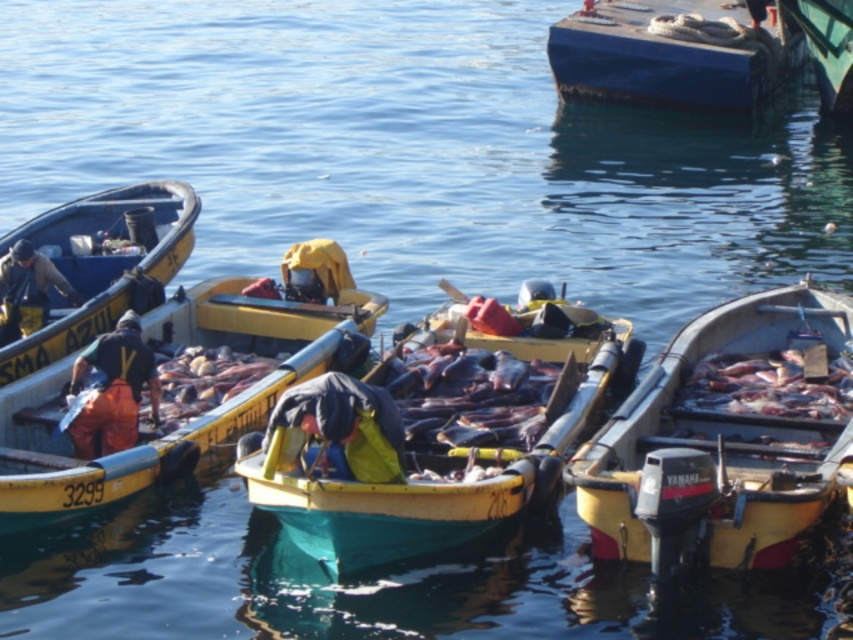
Which is below, teal wooden boat at center or green matte boat at upper right?

teal wooden boat at center is lower down.

Between point (425, 444) and point (817, 74), which one is positioned behind?

Point (817, 74)

Is point (236, 451) positioned after point (827, 99)?

No.

Find the location of `teal wooden boat at center`. teal wooden boat at center is located at coordinates (432, 435).

Which is behind, point (83, 333) or point (824, 65)?

Point (824, 65)

From the picture: Is yellow matte boat at left further to camera compared to green matte boat at upper right?

No, yellow matte boat at left is closer to the viewer.

The image size is (853, 640). In order to click on yellow matte boat at left in this screenshot , I will do `click(100, 262)`.

Locate an element on the screen. This screenshot has width=853, height=640. yellow matte boat at left is located at coordinates (100, 262).

Does smooth blue hull at upper right have a lesser width compared to yellow matte boat at left?

Incorrect, smooth blue hull at upper right's width is not less than yellow matte boat at left's.

Which of these two, smooth blue hull at upper right or yellow matte boat at left, stands taller?

With more height is smooth blue hull at upper right.

Between point (695, 100) and point (164, 212), which one is positioned in front?

Point (164, 212) is more forward.

Locate an element on the screen. smooth blue hull at upper right is located at coordinates (670, 52).